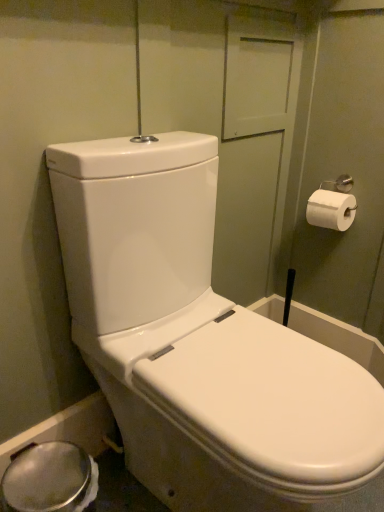
Question: From the image's perspective, does white glossy toilet at center appear lower than white paper at upper right?

Choices:
 (A) yes
 (B) no

Answer: (A)

Question: Does white glossy toilet at center appear on the right side of white paper at upper right?

Choices:
 (A) no
 (B) yes

Answer: (A)

Question: Is the depth of white glossy toilet at center less than that of white paper at upper right?

Choices:
 (A) no
 (B) yes

Answer: (B)

Question: Considering the relative sizes of white glossy toilet at center and white paper at upper right in the image provided, is white glossy toilet at center taller than white paper at upper right?

Choices:
 (A) yes
 (B) no

Answer: (A)

Question: From the image's perspective, is white glossy toilet at center above white paper at upper right?

Choices:
 (A) no
 (B) yes

Answer: (A)

Question: Would you say white glossy toilet at center is outside white paper at upper right?

Choices:
 (A) no
 (B) yes

Answer: (B)

Question: Does white paper at upper right have a lesser height compared to white glossy toilet at center?

Choices:
 (A) yes
 (B) no

Answer: (A)

Question: Is white paper at upper right facing away from white glossy toilet at center?

Choices:
 (A) yes
 (B) no

Answer: (B)

Question: Would you consider white paper at upper right to be distant from white glossy toilet at center?

Choices:
 (A) no
 (B) yes

Answer: (A)

Question: From a real-world perspective, is white paper at upper right physically above white glossy toilet at center?

Choices:
 (A) yes
 (B) no

Answer: (A)

Question: Does white paper at upper right have a greater width compared to white glossy toilet at center?

Choices:
 (A) no
 (B) yes

Answer: (A)

Question: Does white paper at upper right have a lesser width compared to white glossy toilet at center?

Choices:
 (A) no
 (B) yes

Answer: (B)

Question: From their relative heights in the image, would you say white glossy toilet at center is taller or shorter than white paper at upper right?

Choices:
 (A) tall
 (B) short

Answer: (A)